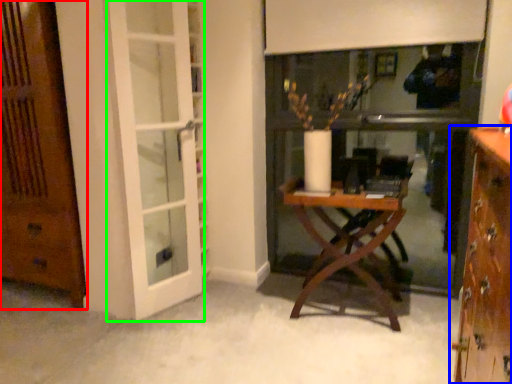
Question: Which object is positioned closest to door (highlighted by a red box)? Select from cabinetry (highlighted by a blue box) and screen door (highlighted by a green box).

Choices:
 (A) cabinetry
 (B) screen door

Answer: (B)